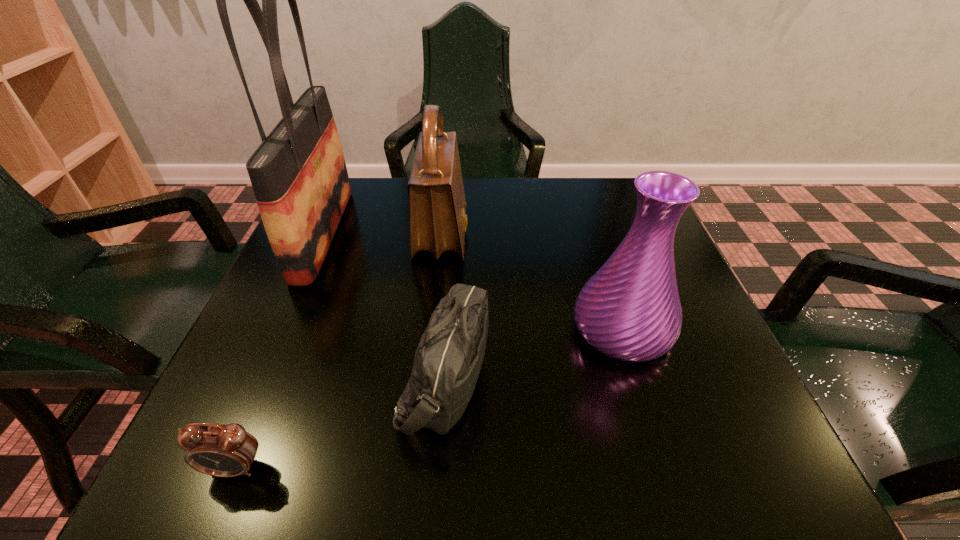
Where is `empty location between the rightmost object and the tallest object`? The height and width of the screenshot is (540, 960). empty location between the rightmost object and the tallest object is located at coordinates (472, 281).

Locate an element on the screen. This screenshot has width=960, height=540. empty space between the fourth tallest object and the nearest object is located at coordinates (340, 423).

Locate an element on the screen. unoccupied position between the farther shoulder bag and the shopping bag is located at coordinates (382, 234).

The height and width of the screenshot is (540, 960). I want to click on object that stands as the closest to the vase, so click(x=447, y=363).

At what (x,y) coordinates should I click in order to perform the action: click on the second closest object to the farther shoulder bag. Please return your answer as a coordinate pair (x, y). This screenshot has height=540, width=960. Looking at the image, I should click on (299, 177).

At what (x,y) coordinates should I click in order to perform the action: click on vacant region that satisfies the following two spatial constraints: 1. on the front-facing side of the shopping bag; 2. on the back side of the vase. Please return your answer as a coordinate pair (x, y). Looking at the image, I should click on (280, 329).

Image resolution: width=960 pixels, height=540 pixels. In order to click on free space that satisfies the following two spatial constraints: 1. at the front padded panel of the shorter shoulder bag; 2. on the face of the alarm clock in this screenshot , I will do pos(439,468).

Where is `vacant space that satisfies the following two spatial constraints: 1. on the front flap of the farther shoulder bag; 2. on the right side of the rightmost object`? The image size is (960, 540). vacant space that satisfies the following two spatial constraints: 1. on the front flap of the farther shoulder bag; 2. on the right side of the rightmost object is located at coordinates (431, 329).

Locate an element on the screen. Image resolution: width=960 pixels, height=540 pixels. vacant space that satisfies the following two spatial constraints: 1. on the front-facing side of the shopping bag; 2. on the back side of the vase is located at coordinates (280, 329).

Where is `vacant area that satisfies the following two spatial constraints: 1. on the front flap of the farther shoulder bag; 2. on the left side of the rightmost object`? This screenshot has height=540, width=960. vacant area that satisfies the following two spatial constraints: 1. on the front flap of the farther shoulder bag; 2. on the left side of the rightmost object is located at coordinates (431, 329).